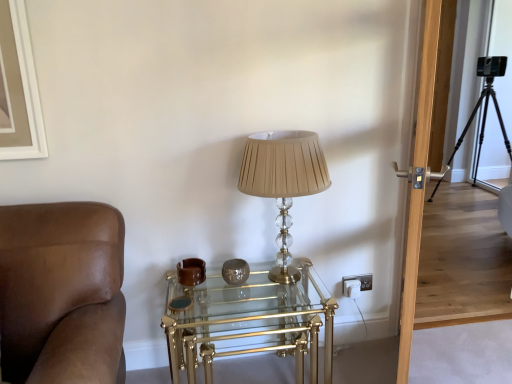
Question: From the image's perspective, would you say translucent beige lampshade at center is shown under black metal tripod at right?

Choices:
 (A) yes
 (B) no

Answer: (A)

Question: Considering the relative sizes of translucent beige lampshade at center and black metal tripod at right in the image provided, is translucent beige lampshade at center bigger than black metal tripod at right?

Choices:
 (A) no
 (B) yes

Answer: (A)

Question: Can you confirm if translucent beige lampshade at center is smaller than black metal tripod at right?

Choices:
 (A) no
 (B) yes

Answer: (B)

Question: Is translucent beige lampshade at center turned away from black metal tripod at right?

Choices:
 (A) yes
 (B) no

Answer: (B)

Question: Does translucent beige lampshade at center appear on the left side of black metal tripod at right?

Choices:
 (A) yes
 (B) no

Answer: (A)

Question: Can you confirm if translucent beige lampshade at center is positioned to the right of black metal tripod at right?

Choices:
 (A) no
 (B) yes

Answer: (A)

Question: Does clear glass/golden metal table at center have a lesser width compared to black metal tripod at right?

Choices:
 (A) no
 (B) yes

Answer: (B)

Question: Can you confirm if clear glass/golden metal table at center is positioned to the left of black metal tripod at right?

Choices:
 (A) no
 (B) yes

Answer: (B)

Question: From the image's perspective, is clear glass/golden metal table at center over black metal tripod at right?

Choices:
 (A) no
 (B) yes

Answer: (A)

Question: Is clear glass/golden metal table at center to the right of black metal tripod at right from the viewer's perspective?

Choices:
 (A) yes
 (B) no

Answer: (B)

Question: Can you confirm if clear glass/golden metal table at center is wider than black metal tripod at right?

Choices:
 (A) no
 (B) yes

Answer: (A)

Question: Could you tell me if clear glass/golden metal table at center is facing black metal tripod at right?

Choices:
 (A) yes
 (B) no

Answer: (B)

Question: Is transparent wooden door at right smaller than black metal tripod at right?

Choices:
 (A) yes
 (B) no

Answer: (A)